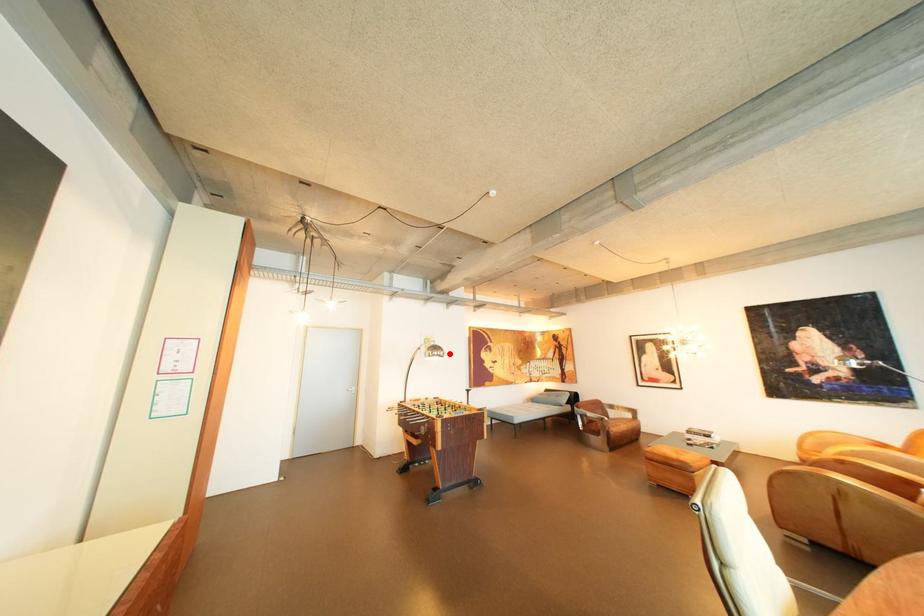
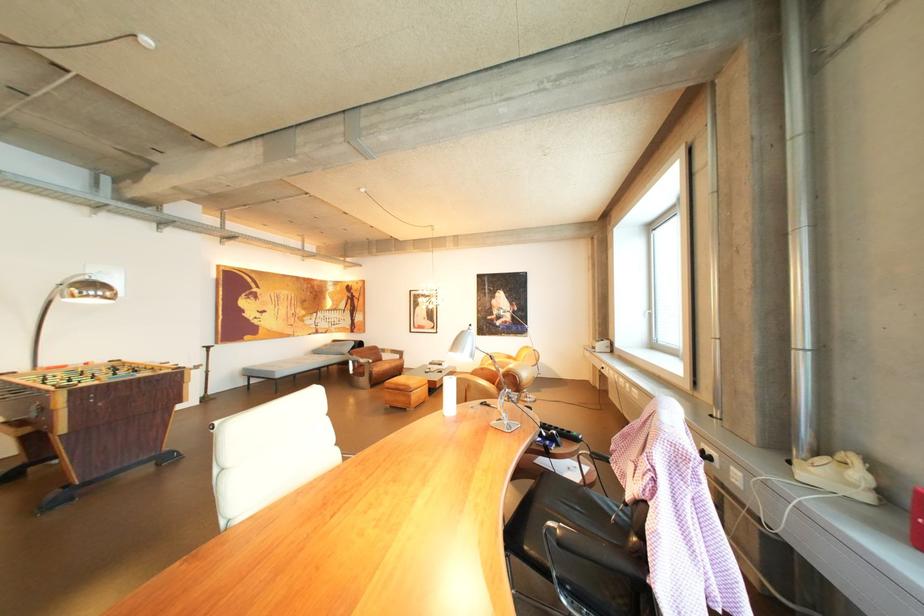
The point at the highlighted location is marked in the first image. Where is the corresponding point in the second image?

(105, 294)